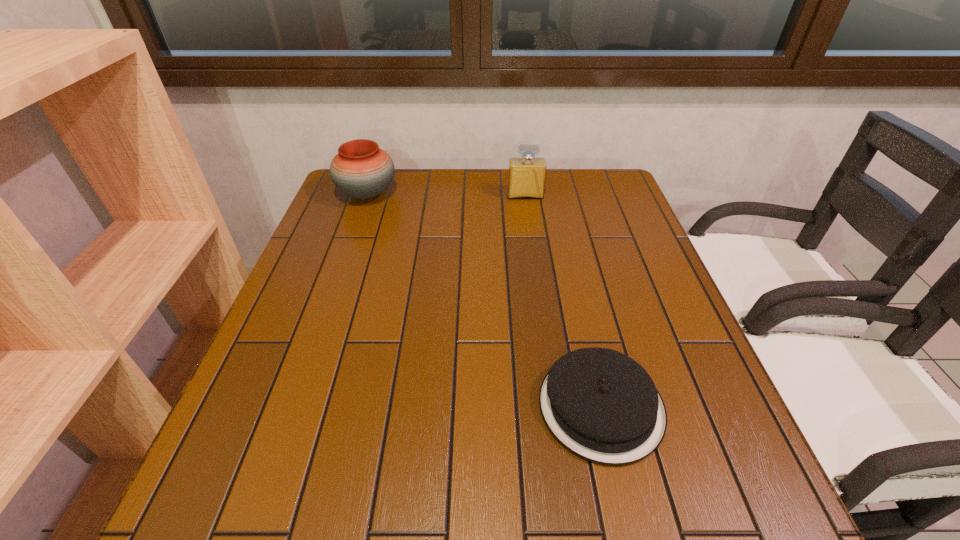
Locate an element on the screen. Image resolution: width=960 pixels, height=540 pixels. free space that satisfies the following two spatial constraints: 1. on the front side of the pancake; 2. on the right side of the leftmost object is located at coordinates (292, 406).

Where is `free spot that satisfies the following two spatial constraints: 1. on the front-facing side of the pancake; 2. on the left side of the perfume`? free spot that satisfies the following two spatial constraints: 1. on the front-facing side of the pancake; 2. on the left side of the perfume is located at coordinates (555, 406).

I want to click on free space that satisfies the following two spatial constraints: 1. on the front side of the nearest object; 2. on the right side of the pottery, so click(x=292, y=406).